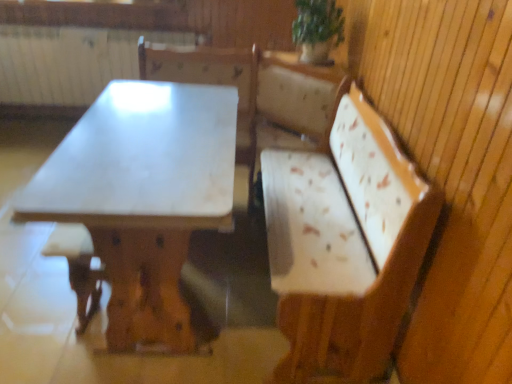
Question: Does white painted radiator at upper left have a lesser height compared to green leafy plant at upper center?

Choices:
 (A) yes
 (B) no

Answer: (B)

Question: Does white painted radiator at upper left have a greater height compared to green leafy plant at upper center?

Choices:
 (A) yes
 (B) no

Answer: (A)

Question: From a real-world perspective, is white painted radiator at upper left on green leafy plant at upper center?

Choices:
 (A) yes
 (B) no

Answer: (B)

Question: From the image's perspective, is white painted radiator at upper left below green leafy plant at upper center?

Choices:
 (A) no
 (B) yes

Answer: (A)

Question: From a real-world perspective, is white painted radiator at upper left below green leafy plant at upper center?

Choices:
 (A) yes
 (B) no

Answer: (A)

Question: Is white painted radiator at upper left positioned beyond the bounds of green leafy plant at upper center?

Choices:
 (A) no
 (B) yes

Answer: (B)

Question: Is white painted radiator at upper left facing away from brown wood step stool at lower left?

Choices:
 (A) no
 (B) yes

Answer: (A)

Question: Is white painted radiator at upper left behind brown wood step stool at lower left?

Choices:
 (A) no
 (B) yes

Answer: (B)

Question: Does white painted radiator at upper left appear on the left side of brown wood step stool at lower left?

Choices:
 (A) yes
 (B) no

Answer: (A)

Question: Can you confirm if white painted radiator at upper left is positioned to the right of brown wood step stool at lower left?

Choices:
 (A) no
 (B) yes

Answer: (A)

Question: Is white painted radiator at upper left outside of brown wood step stool at lower left?

Choices:
 (A) yes
 (B) no

Answer: (A)

Question: Is white painted radiator at upper left thinner than brown wood step stool at lower left?

Choices:
 (A) yes
 (B) no

Answer: (A)

Question: Is brown wood step stool at lower left wider than white marble table at center?

Choices:
 (A) no
 (B) yes

Answer: (A)